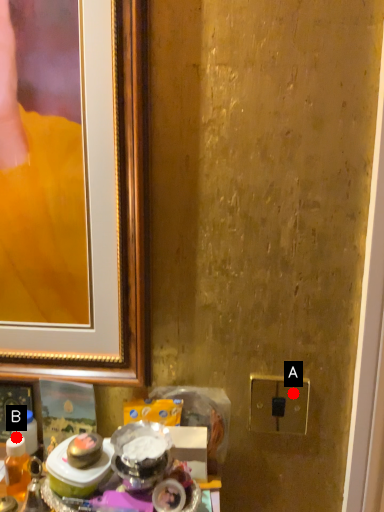
Question: Two points are circled on the image, labeled by A and B beside each circle. Which point appears closest to the camera in this image?

Choices:
 (A) A is closer
 (B) B is closer

Answer: (B)